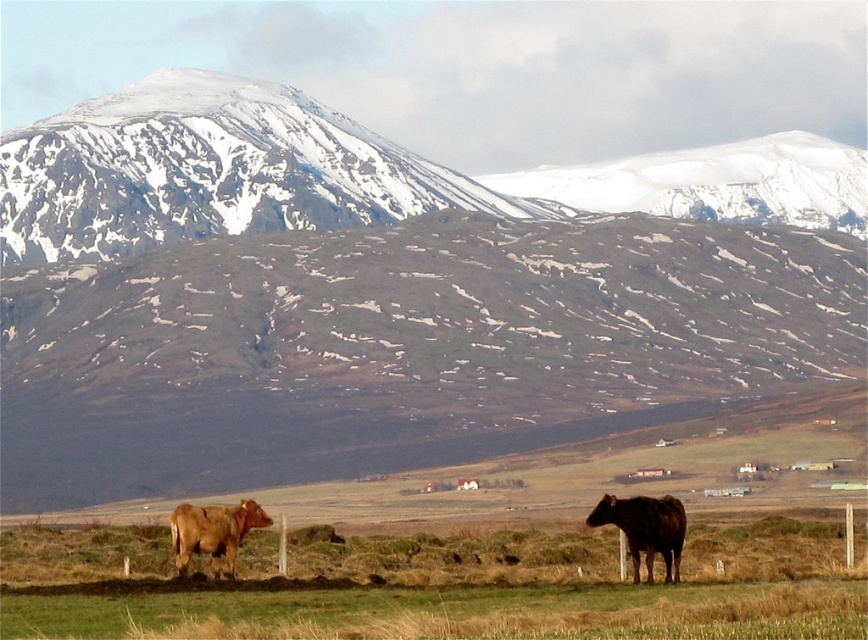
You are a farmer who needs to separate two cows using a fence. The brown glossy cow at lower right and the brown matte cow at lower left are currently 101.90 meters apart. What is the minimum length of the fence required to separate them completely?

The minimum length of the fence required to separate the brown glossy cow at lower right and the brown matte cow at lower left completely is 101.90 meters, as the fence needs to span the distance between them to ensure separation.

You are a photographer planning to take a landscape photo of the snowy rock mountain at upper left and the brown glossy cow at lower right. Since you want both subjects to be clearly visible, which one should you focus on first to ensure proper focus? Please explain your reasoning based on their sizes in the scene.

The snowy rock mountain at upper left has a larger size compared to the brown glossy cow at lower right. Therefore, you should focus on the snowy rock mountain at upper left first because larger objects generally require more precise focus to capture all details clearly.

You are an astronomer analyzing the image of the mountain landscape. You need to locate the snowy rock mountain at upper left for your study. What are its coordinates in the image?

The snowy rock mountain at upper left is located at coordinates (211, 172).